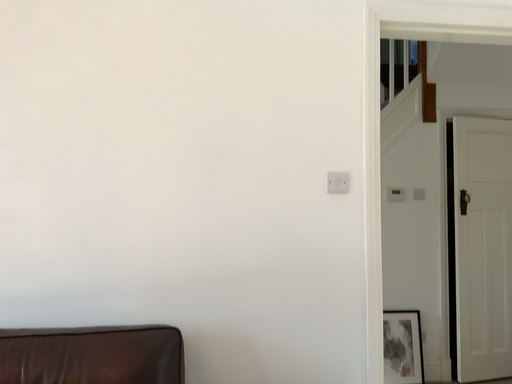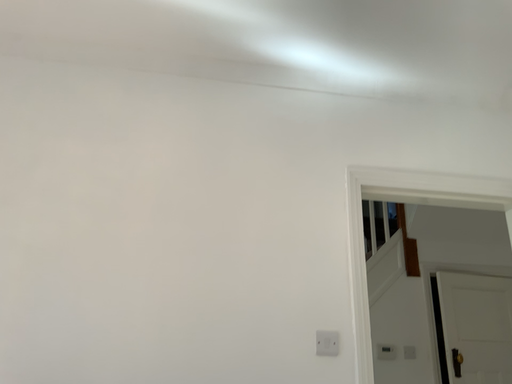
Question: Which way did the camera rotate in the video?

Choices:
 (A) rotated upward
 (B) rotated downward

Answer: (A)